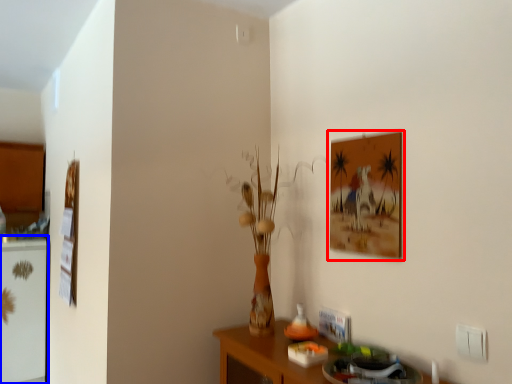
Question: Which object is further to the camera taking this photo, picture frame (highlighted by a red box) or fridge (highlighted by a blue box)?

Choices:
 (A) picture frame
 (B) fridge

Answer: (B)